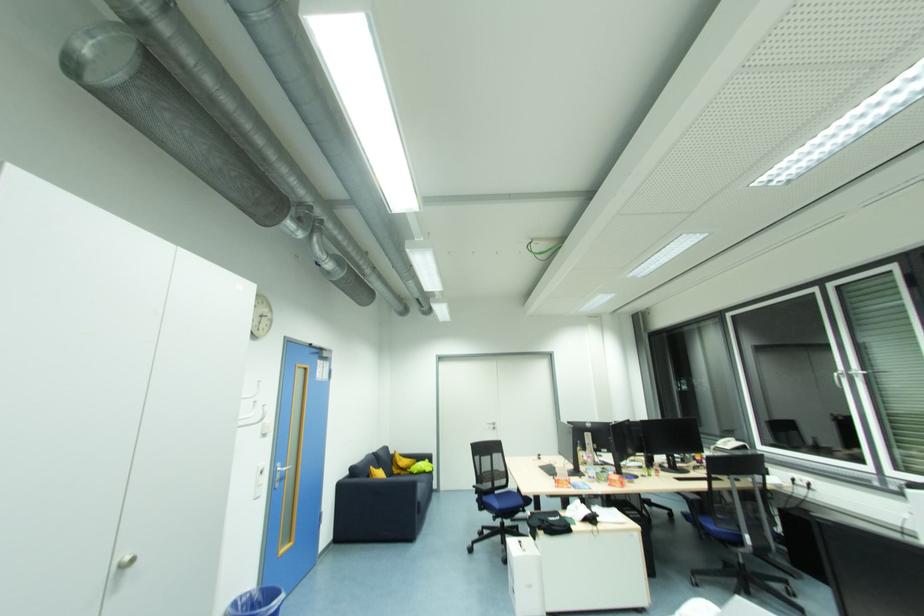
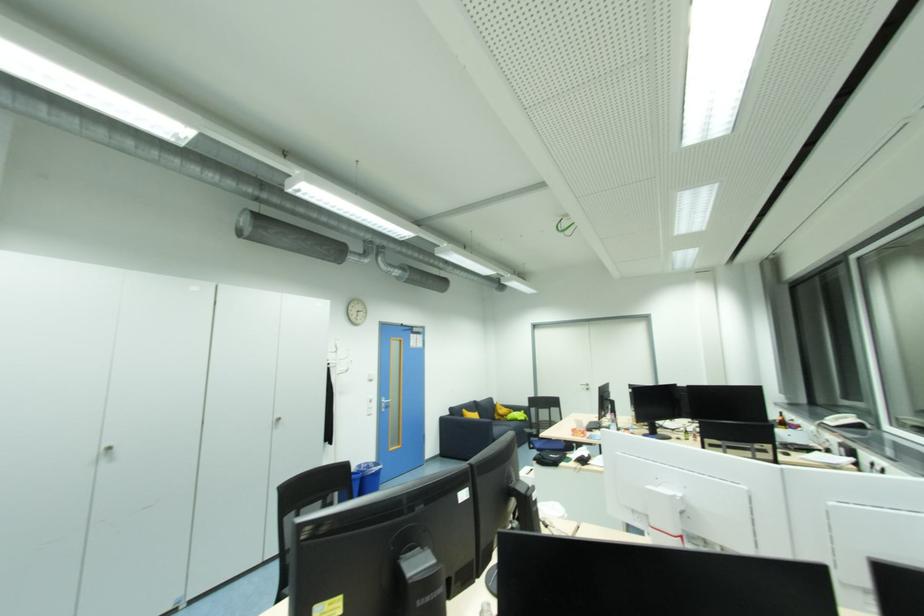
Find the pixel in the second image that matches [132,570] in the first image.

(284, 423)